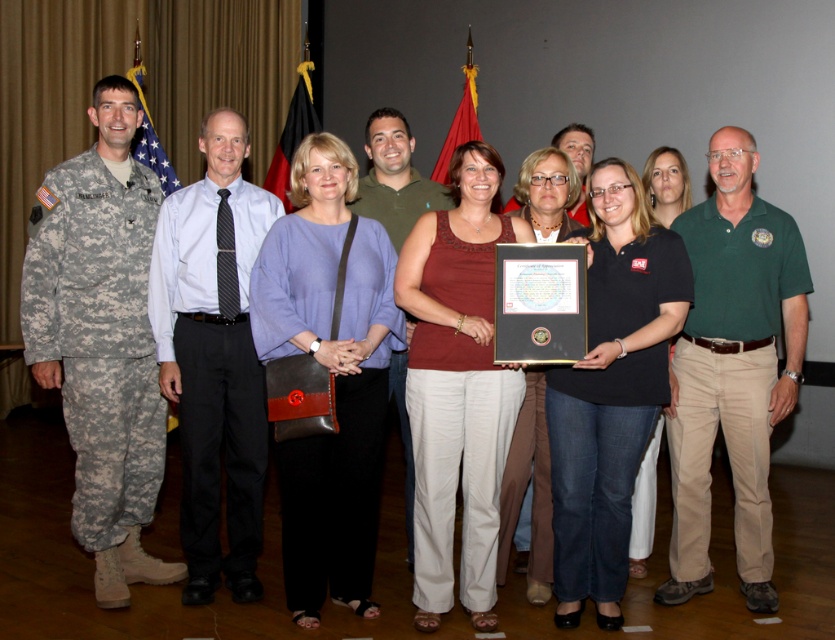
Question: Is camouflage uniform at left bigger than green cotton polo shirt at center?

Choices:
 (A) yes
 (B) no

Answer: (A)

Question: Which point is closer to the camera?

Choices:
 (A) matte black frame at center
 (B) black shirt at center
 (C) green cotton shirt at center
 (D) black cotton shirt at center

Answer: (D)

Question: Which object appears closest to the camera in this image?

Choices:
 (A) black shirt at center
 (B) green cotton polo shirt at center
 (C) black cotton shirt at center

Answer: (C)

Question: From the image, what is the correct spatial relationship of matte red tank top at center in relation to matte black frame at center?

Choices:
 (A) above
 (B) below

Answer: (A)

Question: Which point appears farthest from the camera in this image?

Choices:
 (A) (196, 252)
 (B) (370, 342)
 (C) (418, 204)
 (D) (649, 156)

Answer: (D)

Question: Can you confirm if matte purple blouse at center is smaller than green cotton polo shirt at center?

Choices:
 (A) yes
 (B) no

Answer: (B)